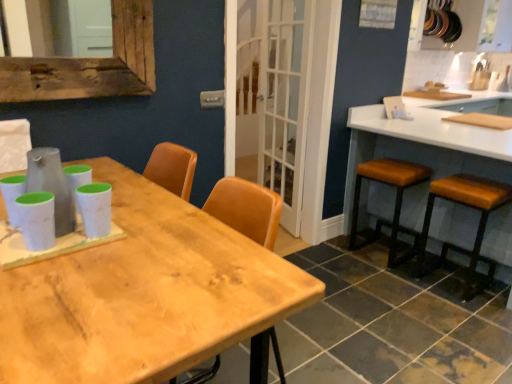
Question: From a real-world perspective, relative to white glass screen door at center, is brown leather stool at right, which is counted as the 1th stool, starting from the left, vertically above or below?

Choices:
 (A) above
 (B) below

Answer: (B)

Question: In terms of width, does brown leather stool at right, which is counted as the 1th stool, starting from the left, look wider or thinner when compared to white glass screen door at center?

Choices:
 (A) wide
 (B) thin

Answer: (A)

Question: Which object is the closest to the white glossy countertop at right?

Choices:
 (A) brown leather stool at right, which is counted as the 1th stool, starting from the left
 (B) white matte chair at upper left
 (C) wooden table at center
 (D) brown leather stool at right, positioned as the 1th stool in right-to-left order
 (E) white glass screen door at center

Answer: (A)

Question: Based on their relative distances, which object is farther from the wooden table at center?

Choices:
 (A) white glossy countertop at right
 (B) white glass screen door at center
 (C) white matte chair at upper left
 (D) brown leather stool at right, positioned as the 1th stool in right-to-left order
 (E) brown leather stool at right, which is the 2th stool in right-to-left order

Answer: (A)